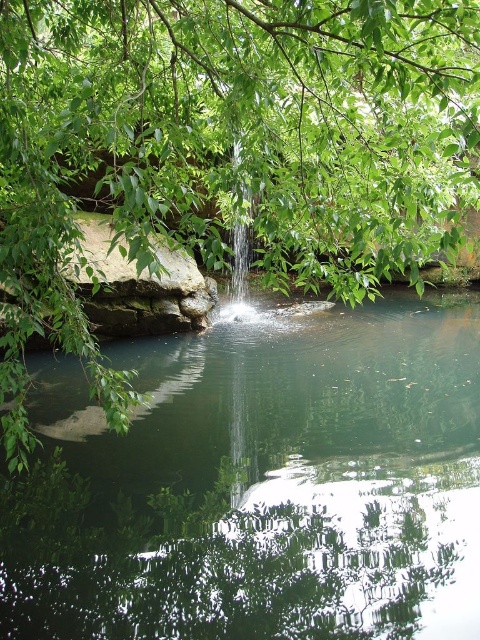
Between point (326, 65) and point (243, 205), which one is positioned in front?

Point (326, 65) is in front.

Is green leafy tree at upper center wider than clear water at center?

Incorrect, green leafy tree at upper center's width does not surpass clear water at center's.

Find the location of `green leafy tree at upper center`. green leafy tree at upper center is located at coordinates (228, 147).

You are a GUI agent. You are given a task and a screenshot of the screen. Output one action in this format:
    pyautogui.click(x=<x>, y=<y>)
    Task: Click on the green liquid at center
    The image size is (480, 640).
    Given the screenshot: What is the action you would take?
    pyautogui.click(x=263, y=484)

Looking at this image, does green liquid at center appear under green leafy tree at upper center?

Correct, green liquid at center is located below green leafy tree at upper center.

Describe the element at coordinates (263, 484) in the screenshot. This screenshot has height=640, width=480. I see `green liquid at center` at that location.

Find the location of a particular element. The image size is (480, 640). green liquid at center is located at coordinates pyautogui.click(x=263, y=484).

Can you confirm if green liquid at center is positioned to the right of clear water at center?

Yes, green liquid at center is to the right of clear water at center.

Does green liquid at center have a smaller size compared to clear water at center?

No.

Which is in front, point (210, 468) or point (243, 216)?

Point (210, 468) is in front.

The height and width of the screenshot is (640, 480). In order to click on green liquid at center in this screenshot , I will do `click(263, 484)`.